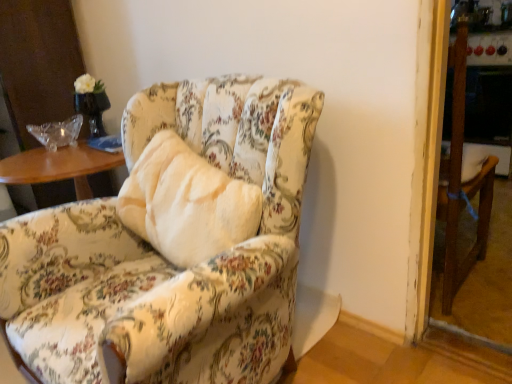
In order to face floral fabric chair at center, should I rotate leftwards or rightwards?

You should look left and rotate roughly 11.831 degrees.

What do you see at coordinates (172, 245) in the screenshot? I see `floral fabric chair at center` at bounding box center [172, 245].

At what (x,y) coordinates should I click in order to perform the action: click on floral fabric chair at center. Please return your answer as a coordinate pair (x, y). The width and height of the screenshot is (512, 384). Looking at the image, I should click on (172, 245).

This screenshot has width=512, height=384. Find the location of `floral fabric chair at center`. floral fabric chair at center is located at coordinates (172, 245).